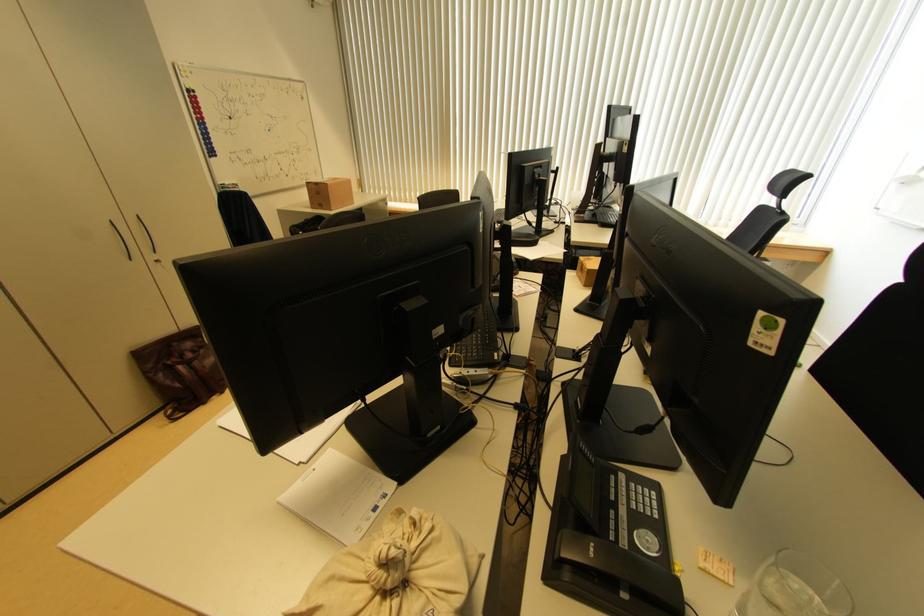
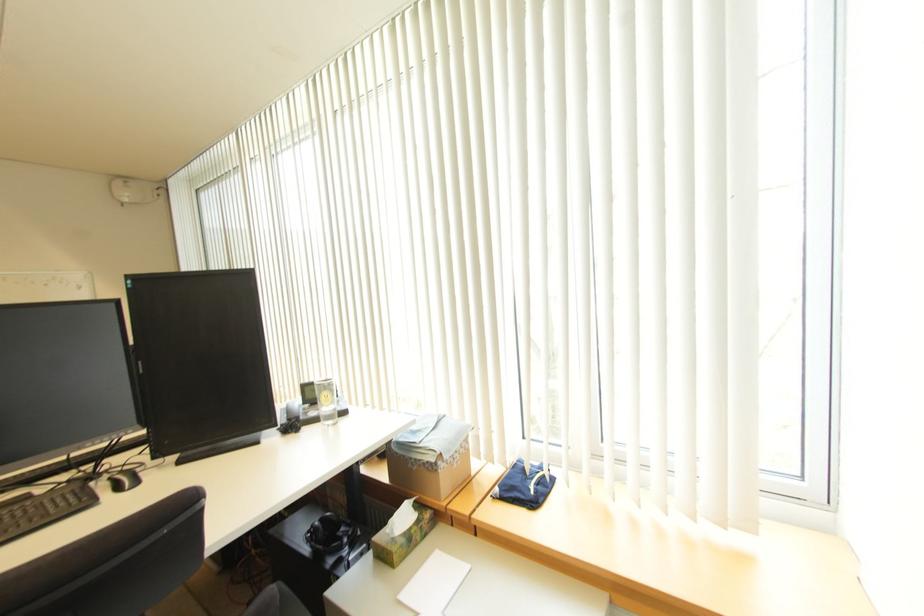
In a continuous first-person perspective shot, in which direction is the camera moving?

The movement direction of the cameraman is right, forward.